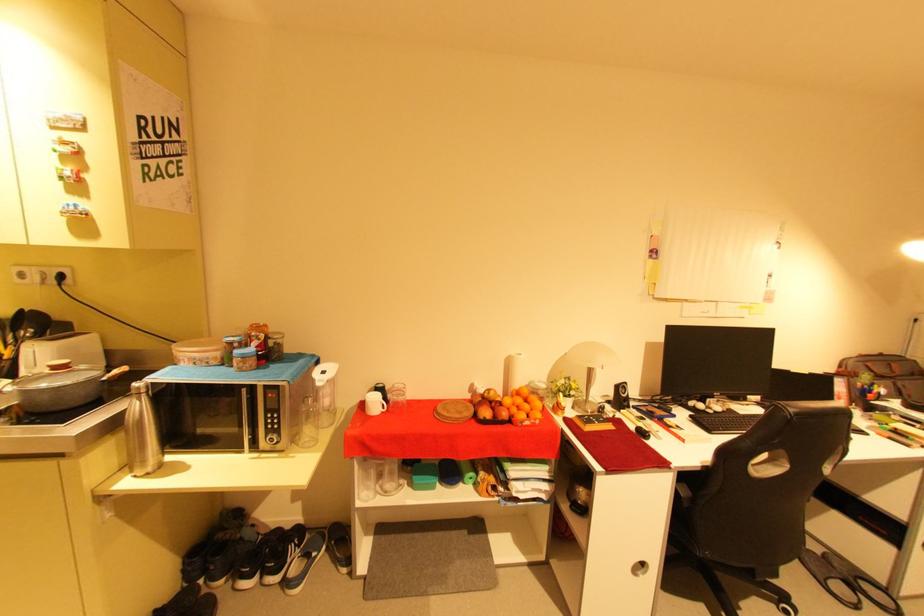
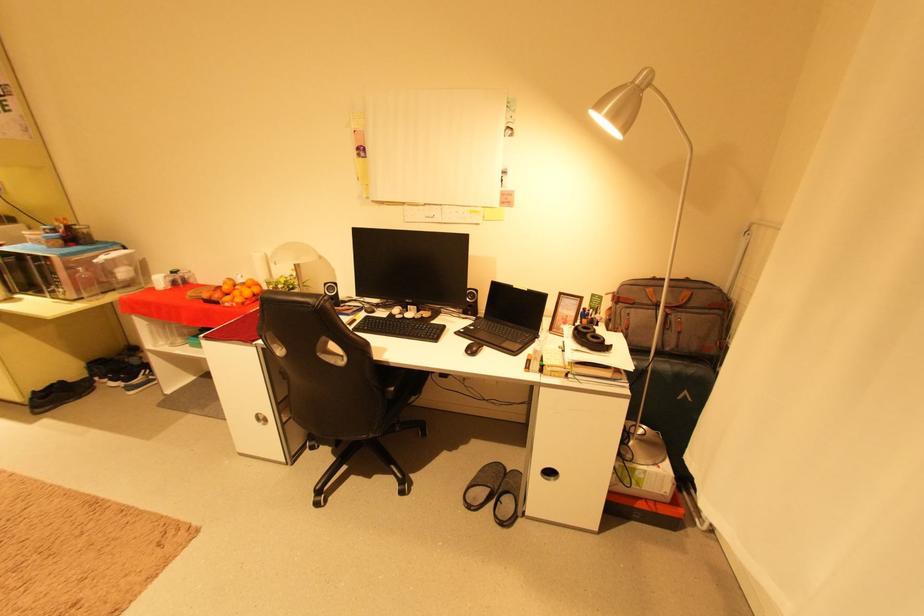
Question: I am providing you with two images of the same scene from different viewpoints. After the viewpoint changes to image2, which objects are now occluded?

Choices:
 (A) black speaker
 (B) black computer mouse
 (C) black headphones
 (D) none of these

Answer: (D)